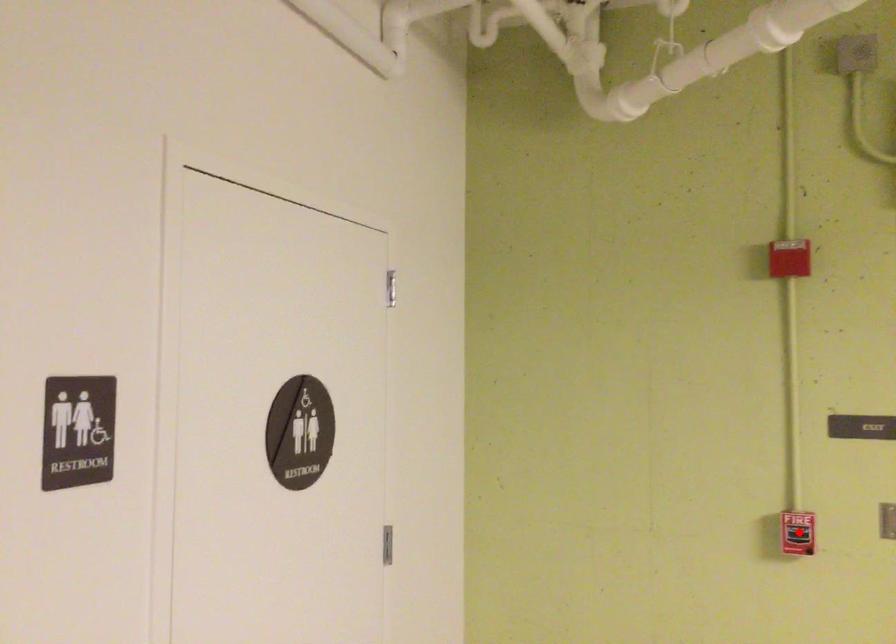
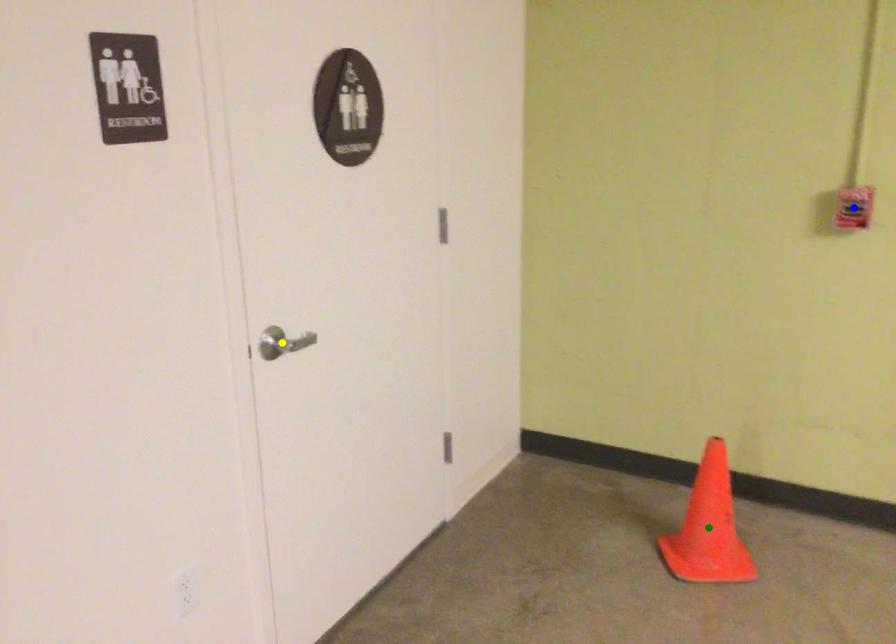
Question: I am providing you with two images of the same scene from different viewpoints. A red point is marked on the first image. You are given multiple points on the second image. Can you choose the point in image 2 that corresponds to the point in image 1?

Choices:
 (A) blue point
 (B) yellow point
 (C) green point

Answer: (A)